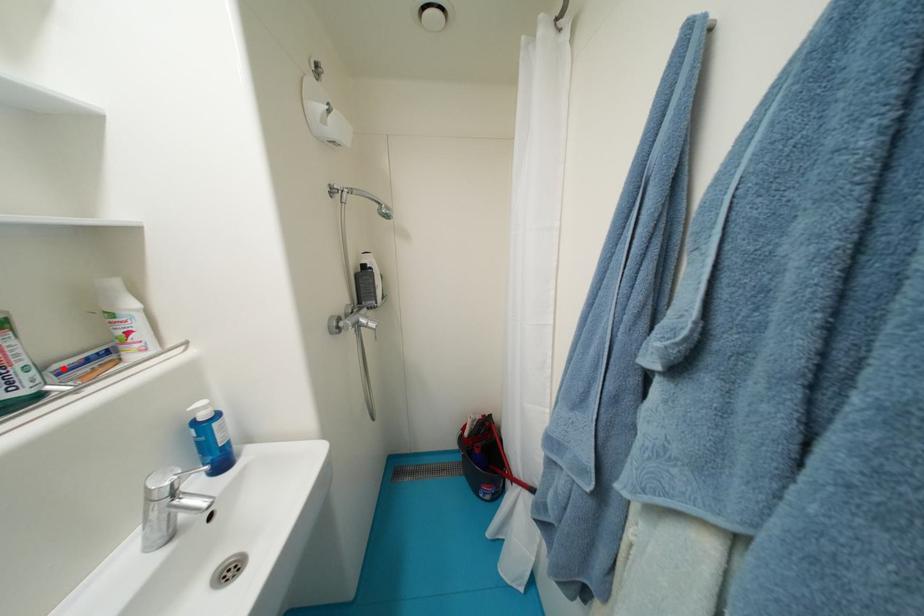
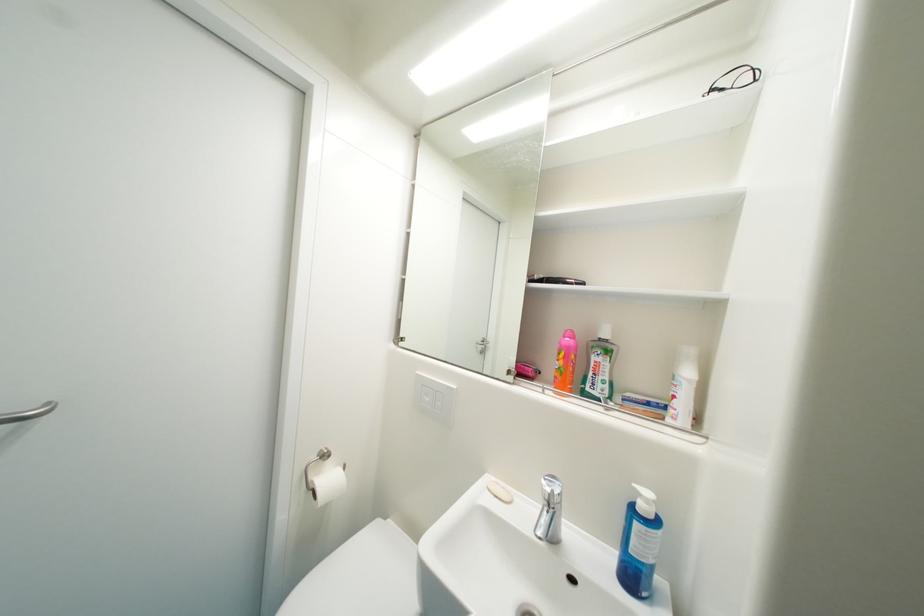
In the second image, find the point that corresponds to the highlighted location in the first image.

(635, 397)